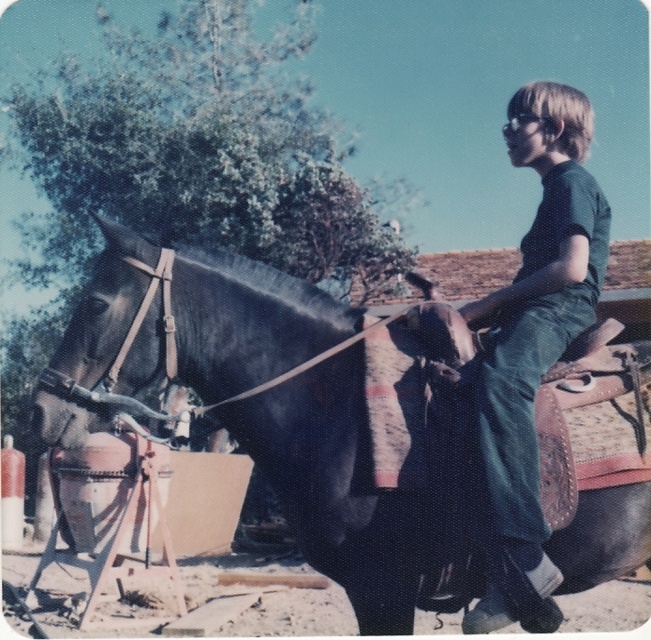
Question: Which object appears farthest from the camera in this image?

Choices:
 (A) green denim pants at center
 (B) shiny black horse at center

Answer: (A)

Question: Does shiny black horse at center lie in front of green denim pants at center?

Choices:
 (A) no
 (B) yes

Answer: (B)

Question: Which point is farther from the camera taking this photo?

Choices:
 (A) (450, 474)
 (B) (559, 620)

Answer: (A)

Question: Is shiny black horse at center above green denim pants at center?

Choices:
 (A) no
 (B) yes

Answer: (A)

Question: Does shiny black horse at center have a greater width compared to green denim pants at center?

Choices:
 (A) no
 (B) yes

Answer: (B)